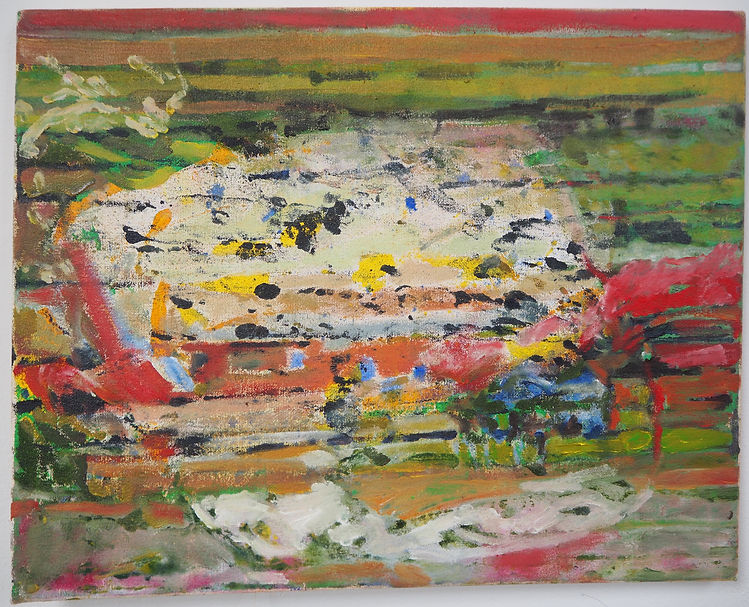
The height and width of the screenshot is (607, 749). Identify the location of painting. (333, 300), (333, 331).